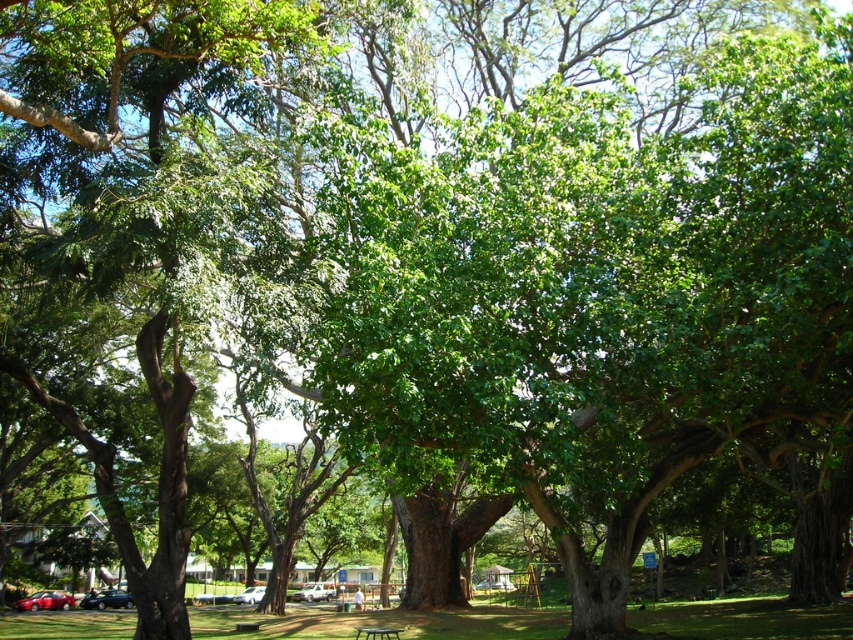
Does shiny red sedan at lower left appear over black plastic bench at center?

Incorrect, shiny red sedan at lower left is not positioned above black plastic bench at center.

Between shiny red sedan at lower left and black plastic bench at center, which one has less height?

Standing shorter between the two is black plastic bench at center.

Who is more distant from viewer, (65, 604) or (368, 628)?

Point (65, 604)

Locate an element on the screen. shiny red sedan at lower left is located at coordinates (45, 602).